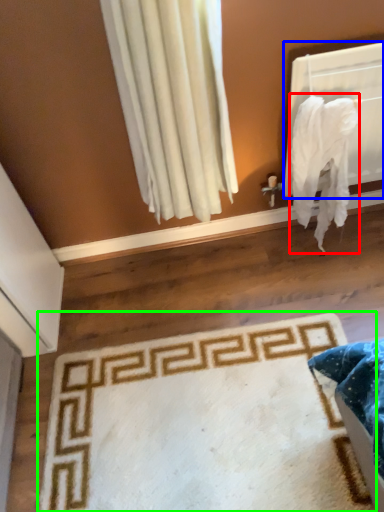
Question: Considering the real-world distances, which object is closest to blanket (highlighted by a red box)? window screen (highlighted by a blue box) or mat (highlighted by a green box).

Choices:
 (A) window screen
 (B) mat

Answer: (A)